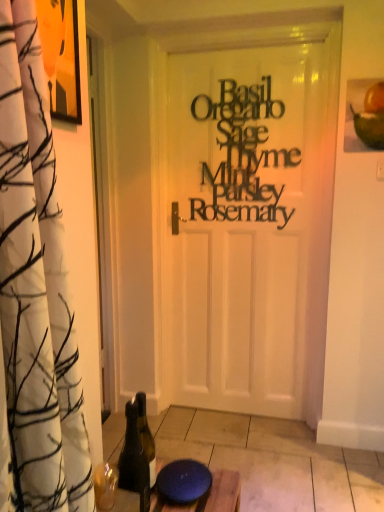
The image size is (384, 512). What do you see at coordinates (242, 154) in the screenshot?
I see `black paper sign at center` at bounding box center [242, 154].

Where is `black paper sign at center`? black paper sign at center is located at coordinates (242, 154).

The width and height of the screenshot is (384, 512). Describe the element at coordinates (133, 456) in the screenshot. I see `green glass bottle at lower left` at that location.

The width and height of the screenshot is (384, 512). I want to click on green glass bottle at lower left, so click(133, 456).

Identify the location of black paper sign at center. (242, 154).

Can you confirm if green glass bottle at lower left is positioned to the right of black paper sign at center?

In fact, green glass bottle at lower left is to the left of black paper sign at center.

Who is more distant, green glass bottle at lower left or black paper sign at center?

black paper sign at center is behind.

Is point (144, 461) less distant than point (219, 149)?

Yes, point (144, 461) is in front of point (219, 149).

From the picture: From the image's perspective, who appears lower, green glass bottle at lower left or black paper sign at center?

green glass bottle at lower left appears lower in the image.

Consider the image. From a real-world perspective, who is located higher, green glass bottle at lower left or black paper sign at center?

black paper sign at center, from a real-world perspective.

Considering the relative sizes of green glass bottle at lower left and black paper sign at center in the image provided, is green glass bottle at lower left thinner than black paper sign at center?

No, green glass bottle at lower left is not thinner than black paper sign at center.

Between green glass bottle at lower left and black paper sign at center, which one has more height?

black paper sign at center is taller.

In terms of size, does green glass bottle at lower left appear bigger or smaller than black paper sign at center?

In the image, green glass bottle at lower left appears to be smaller than black paper sign at center.

Is black paper sign at center located within green glass bottle at lower left?

No, black paper sign at center is located outside of green glass bottle at lower left.

Would you say green glass bottle at lower left is a long distance from black paper sign at center?

Indeed, green glass bottle at lower left is not near black paper sign at center.

Is green glass bottle at lower left aimed at black paper sign at center?

No, green glass bottle at lower left is not turned towards black paper sign at center.

Locate an element on the screen. The height and width of the screenshot is (512, 384). bottle below the black paper sign at center (from the image's perspective) is located at coordinates (133, 456).

Considering the positions of objects black paper sign at center and green glass bottle at lower left in the image provided, who is more to the left, black paper sign at center or green glass bottle at lower left?

Positioned to the left is green glass bottle at lower left.

Which object is further away from the camera taking this photo, black paper sign at center or green glass bottle at lower left?

black paper sign at center.

Does point (251, 152) come farther from viewer compared to point (132, 450)?

Yes, point (251, 152) is farther from viewer.

From the image's perspective, is black paper sign at center located above or below green glass bottle at lower left?

Clearly, from the image's perspective, black paper sign at center is above green glass bottle at lower left.

From a real-world perspective, which is physically above, black paper sign at center or green glass bottle at lower left?

From a 3D spatial view, black paper sign at center is above.

Can you confirm if black paper sign at center is thinner than green glass bottle at lower left?

Indeed, black paper sign at center has a lesser width compared to green glass bottle at lower left.

From the picture: Which of these two, black paper sign at center or green glass bottle at lower left, stands shorter?

green glass bottle at lower left.

Based on their sizes in the image, would you say black paper sign at center is bigger or smaller than green glass bottle at lower left?

Clearly, black paper sign at center is larger in size than green glass bottle at lower left.

Is green glass bottle at lower left completely or partially inside black paper sign at center?

No, green glass bottle at lower left is not inside black paper sign at center.

Is black paper sign at center far from green glass bottle at lower left?

Yes.

Could you tell me if black paper sign at center is turned towards green glass bottle at lower left?

Yes, black paper sign at center is aimed at green glass bottle at lower left.

Locate an element on the screen. The width and height of the screenshot is (384, 512). bottle that appears in front of the black paper sign at center is located at coordinates (133, 456).

Locate an element on the screen. Image resolution: width=384 pixels, height=512 pixels. writing located on the right of green glass bottle at lower left is located at coordinates (242, 154).

At what (x,y) coordinates should I click in order to perform the action: click on writing above the green glass bottle at lower left (from the image's perspective). Please return your answer as a coordinate pair (x, y). The width and height of the screenshot is (384, 512). Looking at the image, I should click on (242, 154).